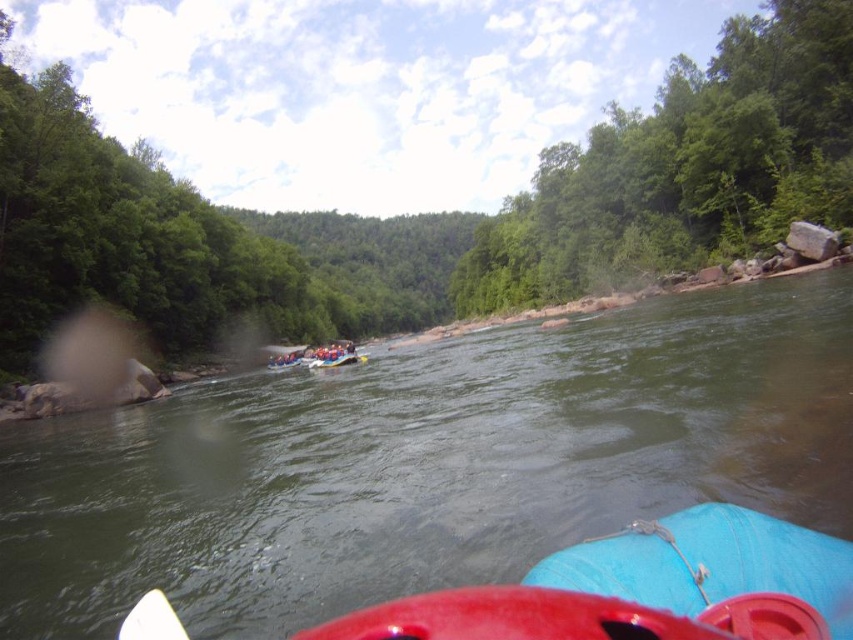
You are on a river rafting trip and need to choose between the blue rubber canoe at lower right and the white plastic paddle at lower center. Which one is wider?

The blue rubber canoe at lower right is wider than the white plastic paddle at lower center.

You are navigating a raft in the river and see two points marked on the river. The first point is at coordinates point (160,461) and the second is at point (697,516). From your perspective on the raft, which point is closer to you?

Point (697,516) is closer to you because it is in front of point (160,461).

You are on a river rafting trip and need to choose between the green rubber raft at center and the white plastic paddle at lower center. Which one is wider?

The green rubber raft at center is wider than the white plastic paddle at lower center.